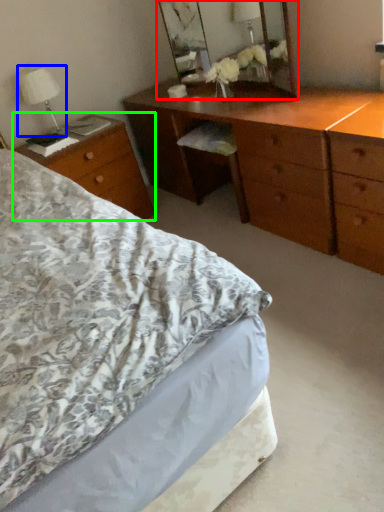
Question: Which object is positioned farthest from mirror (highlighted by a red box)? Select from bedside lamp (highlighted by a blue box) and desk (highlighted by a green box).

Choices:
 (A) bedside lamp
 (B) desk

Answer: (A)